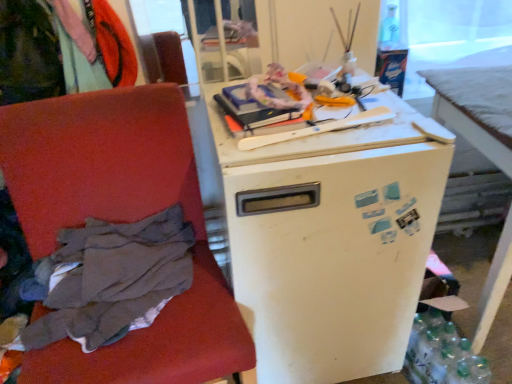
Identify the location of vacant space to the right of wooden skateboard at upper center. (391, 134).